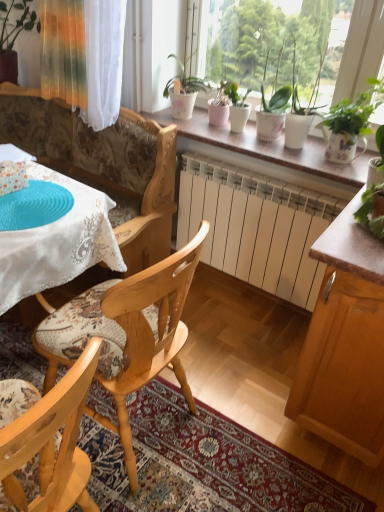
The image size is (384, 512). Identify the location of translucent glass vase at upper left, the third houseplant when ordered from right to left. (28, 58).

The image size is (384, 512). I want to click on wooden placemat at lower center, so click(206, 463).

This screenshot has width=384, height=512. What do you see at coordinates (56, 239) in the screenshot? I see `white lace tablecloth at upper left` at bounding box center [56, 239].

The width and height of the screenshot is (384, 512). Describe the element at coordinates (268, 148) in the screenshot. I see `white ceramic pots at center` at that location.

This screenshot has width=384, height=512. What do you see at coordinates (49, 439) in the screenshot? I see `light wood chair at center, which appears as the second chair when viewed from the back` at bounding box center [49, 439].

Locate an element on the screen. The width and height of the screenshot is (384, 512). white ceramic pot at upper right, the first houseplant from the right is located at coordinates (354, 115).

What's the angular difference between white ceramic pots at center and light wood chair at center, which appears as the second chair when viewed from the back,'s facing directions?

The angle between the facing direction of white ceramic pots at center and the facing direction of light wood chair at center, which appears as the second chair when viewed from the back, is 93.1 degrees.

From a real-world perspective, is white ceramic pots at center physically below light wood chair at center, which appears as the second chair when viewed from the back?

Incorrect, from a real-world perspective, white ceramic pots at center is higher than light wood chair at center, which appears as the second chair when viewed from the back.

Is white ceramic pots at center shorter than light wood chair at center, positioned as the 1th chair in front-to-back order?

Yes.

From the image's perspective, which one is positioned lower, white ceramic pots at center or light wood chair at center, which appears as the second chair when viewed from the back?

light wood chair at center, which appears as the second chair when viewed from the back.

From the image's perspective, is matte brown cabinet at right below translucent glass vase at upper left, the third houseplant when ordered from right to left?

Yes, from the image's perspective, matte brown cabinet at right is beneath translucent glass vase at upper left, the third houseplant when ordered from right to left.

Is matte brown cabinet at right with translucent glass vase at upper left, the third houseplant when ordered from right to left?

No, matte brown cabinet at right is not beside translucent glass vase at upper left, the third houseplant when ordered from right to left.

Considering the points (365, 452) and (15, 15), which point is behind, point (365, 452) or point (15, 15)?

The point (15, 15) is farther.

Does matte brown cabinet at right have a greater width compared to translucent glass vase at upper left, which is counted as the third houseplant, starting from the front?

Yes.

Is matte white pot at center, which ranks as the 2th houseplant in bottom-to-top order, oriented away from white ceramic pot at upper right, the 3th houseplant positioned from the top?

That's not correct — matte white pot at center, which ranks as the 2th houseplant in bottom-to-top order, is not looking away from white ceramic pot at upper right, the 3th houseplant positioned from the top.

Is white ceramic pot at upper right, the third houseplant in the back-to-front sequence, surrounded by matte white pot at center, which ranks as the 2th houseplant in left-to-right order?

No, white ceramic pot at upper right, the third houseplant in the back-to-front sequence, is not a part of matte white pot at center, which ranks as the 2th houseplant in left-to-right order.

Is matte white pot at center, which ranks as the 2th houseplant in left-to-right order, touching white ceramic pot at upper right, the 3th houseplant positioned from the top?

No, matte white pot at center, which ranks as the 2th houseplant in left-to-right order, is not next to white ceramic pot at upper right, the 3th houseplant positioned from the top.

Is matte white pot at center, arranged as the second houseplant when viewed from the right, to the left of white ceramic pot at upper right, positioned as the 3th houseplant in left-to-right order, from the viewer's perspective?

Indeed, matte white pot at center, arranged as the second houseplant when viewed from the right, is positioned on the left side of white ceramic pot at upper right, positioned as the 3th houseplant in left-to-right order.

Are translucent glass vase at upper left, the first houseplant viewed from the back, and matte brown cabinet at right located far from each other?

Yes, translucent glass vase at upper left, the first houseplant viewed from the back, and matte brown cabinet at right are quite far apart.

Is translucent glass vase at upper left, positioned as the 3th houseplant in bottom-to-top order, surrounding matte brown cabinet at right?

No, matte brown cabinet at right is located outside of translucent glass vase at upper left, positioned as the 3th houseplant in bottom-to-top order.

From the image's perspective, does translucent glass vase at upper left, positioned as the 3th houseplant in bottom-to-top order, appear lower than matte brown cabinet at right?

Incorrect, from the image's perspective, translucent glass vase at upper left, positioned as the 3th houseplant in bottom-to-top order, is higher than matte brown cabinet at right.

Does translucent glass vase at upper left, the 1th houseplant when ordered from left to right, turn towards matte brown cabinet at right?

No, translucent glass vase at upper left, the 1th houseplant when ordered from left to right, is not turned towards matte brown cabinet at right.

Does wooden couch at center touch matte brown cabinet at right?

No.

Could you tell me if wooden couch at center is turned towards matte brown cabinet at right?

No, wooden couch at center does not turn towards matte brown cabinet at right.

Considering the sizes of objects wooden couch at center and matte brown cabinet at right in the image provided, who is taller, wooden couch at center or matte brown cabinet at right?

Standing taller between the two is wooden couch at center.

Is matte brown cabinet at right at the right side of wooden couch at center?

Yes.

From the picture: Can you tell me how much matte brown cabinet at right and wooden couch at center differ in facing direction?

There is a 3.15-degree angle between the facing directions of matte brown cabinet at right and wooden couch at center.

Does matte brown cabinet at right have a greater width compared to wooden couch at center?

Yes, matte brown cabinet at right is wider than wooden couch at center.

From the picture: Is matte brown cabinet at right located outside white ceramic pots at center?

That's correct, matte brown cabinet at right is outside of white ceramic pots at center.

Is matte brown cabinet at right directly adjacent to white ceramic pots at center?

matte brown cabinet at right and white ceramic pots at center are not in contact.

From a real-world perspective, is matte brown cabinet at right on white ceramic pots at center?

Incorrect, from a real-world perspective, matte brown cabinet at right is lower than white ceramic pots at center.

Is white ceramic pots at center at the back of matte brown cabinet at right?

No, white ceramic pots at center is not at the back of matte brown cabinet at right.

Starting from the white ceramic pots at center, which chair is the 2nd one in front? Please provide its 2D coordinates.

[(49, 439)]

Starting from the matte brown cabinet at right, which houseplant is the 3rd one behind? Please provide its 2D coordinates.

[(28, 58)]

Looking at the image, which one is located closer to matte white pot at center, which ranks as the 2th houseplant in left-to-right order, wooden placemat at lower center or blue textured paper plate at upper left?

The object closer to matte white pot at center, which ranks as the 2th houseplant in left-to-right order, is blue textured paper plate at upper left.

Which object lies further to the anchor point wooden placemat at lower center, translucent glass vase at upper left, the first houseplant viewed from the back, or blue textured paper plate at upper left?

translucent glass vase at upper left, the first houseplant viewed from the back.

Looking at the image, which one is located closer to matte brown cabinet at right, blue textured paper plate at upper left or white ceramic pots at center?

white ceramic pots at center lies closer to matte brown cabinet at right than the other object.

From the image, which object appears to be nearer to white lace tablecloth at upper left, translucent glass vase at upper left, the third houseplant when ordered from right to left, or matte brown cabinet at right?

Based on the image, matte brown cabinet at right appears to be nearer to white lace tablecloth at upper left.

Looking at the image, which one is located further to translucent glass vase at upper left, which ranks as the 1th houseplant in top-to-bottom order, white ceramic pots at center or wooden placemat at lower center?

Among the two, wooden placemat at lower center is located further to translucent glass vase at upper left, which ranks as the 1th houseplant in top-to-bottom order.

Based on their spatial positions, is white ceramic pot at upper right, which ranks as the first houseplant in front-to-back order, or translucent glass vase at upper left, which is counted as the third houseplant, starting from the front, closer to light wood chair at center, which appears as the second chair when viewed from the back?

white ceramic pot at upper right, which ranks as the first houseplant in front-to-back order, is positioned closer to the anchor light wood chair at center, which appears as the second chair when viewed from the back.

From the image, which object appears to be nearer to translucent glass vase at upper left, the first houseplant viewed from the back, light wood chair at center, which ranks as the second chair in front-to-back order, or white ceramic pots at center?

Based on the image, white ceramic pots at center appears to be nearer to translucent glass vase at upper left, the first houseplant viewed from the back.

Looking at the image, which one is located closer to light wood chair at center, which ranks as the second chair in front-to-back order, wooden placemat at lower center or white ceramic pots at center?

Among the two, wooden placemat at lower center is located nearer to light wood chair at center, which ranks as the second chair in front-to-back order.

The image size is (384, 512). What are the coordinates of `paper plate positioned between light wood chair at center, positioned as the 1th chair in front-to-back order, and wooden couch at center from near to far` in the screenshot? It's located at (34, 206).

The width and height of the screenshot is (384, 512). What are the coordinates of `window sill between translucent glass vase at upper left, positioned as the 3th houseplant in bottom-to-top order, and light wood chair at center, which ranks as the second chair in front-to-back order, in the up-down direction` in the screenshot? It's located at (268, 148).

At what (x,y) coordinates should I click in order to perform the action: click on houseplant between matte white pot at center, which ranks as the 2th houseplant in left-to-right order, and matte brown cabinet at right vertically. Please return your answer as a coordinate pair (x, y). Looking at the image, I should click on (354, 115).

Where is `houseplant between wooden couch at center and white ceramic pot at upper right, positioned as the 3th houseplant in left-to-right order`? The width and height of the screenshot is (384, 512). houseplant between wooden couch at center and white ceramic pot at upper right, positioned as the 3th houseplant in left-to-right order is located at coordinates (237, 106).